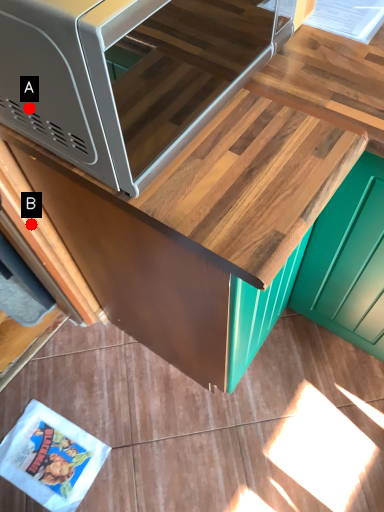
Question: Two points are circled on the image, labeled by A and B beside each circle. Which point is closer to the camera taking this photo?

Choices:
 (A) A is closer
 (B) B is closer

Answer: (A)